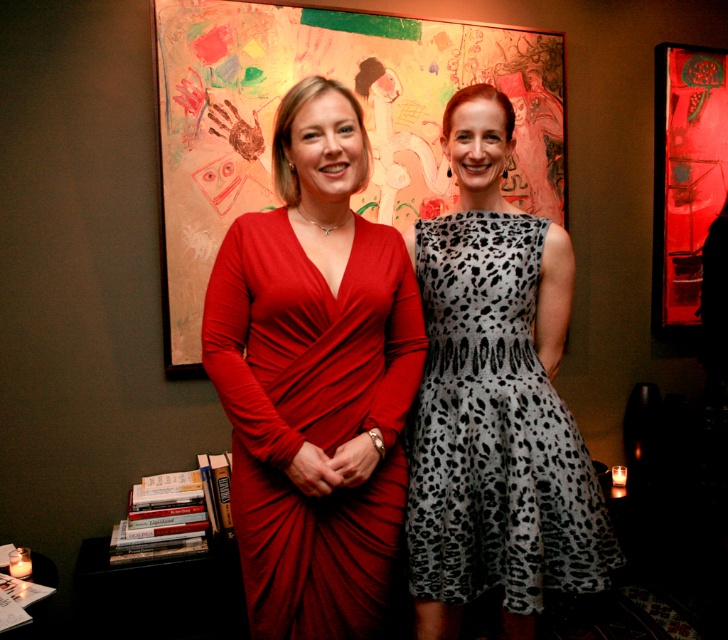
From the picture: Between matte red dress at center and gray leopard print dress at center, which one is positioned lower?

Positioned lower is gray leopard print dress at center.

Measure the distance between point (298, 472) and camera.

Point (298, 472) is 4.44 feet away from camera.

Between point (242, 564) and point (451, 317), which one is positioned behind?

Point (451, 317)

Identify the location of matte red dress at center. This screenshot has height=640, width=728. (314, 378).

Can you confirm if painted canvas artwork at center is positioned to the right of gray leopard print dress at center?

In fact, painted canvas artwork at center is to the left of gray leopard print dress at center.

Which is behind, point (261, 8) or point (555, 509)?

Point (261, 8)

Image resolution: width=728 pixels, height=640 pixels. I want to click on painted canvas artwork at center, so click(352, 97).

Consider the image. Is matte red dress at center further to camera compared to painted canvas artwork at center?

No, matte red dress at center is closer to the viewer.

Can you confirm if matte red dress at center is positioned to the right of painted canvas artwork at center?

In fact, matte red dress at center is to the left of painted canvas artwork at center.

I want to click on matte red dress at center, so click(x=314, y=378).